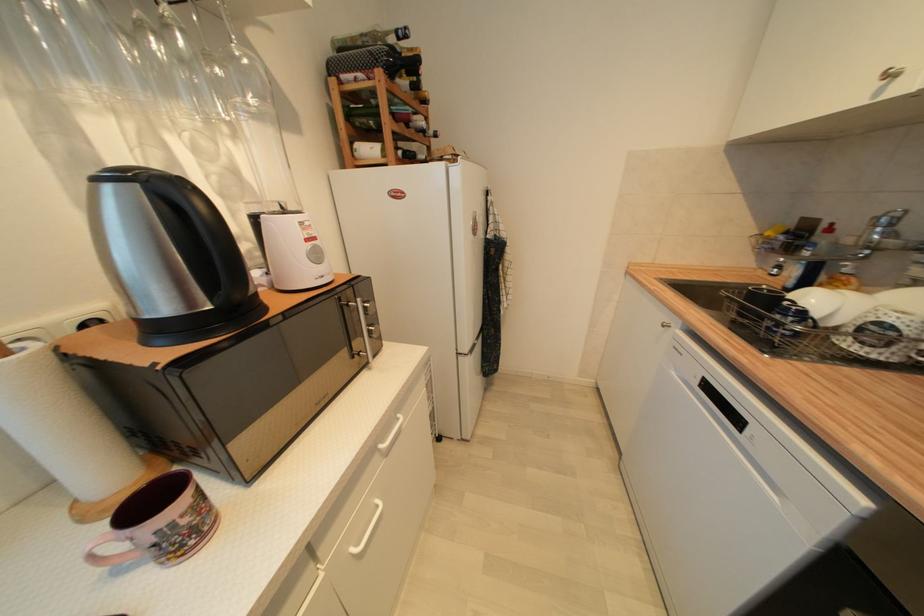
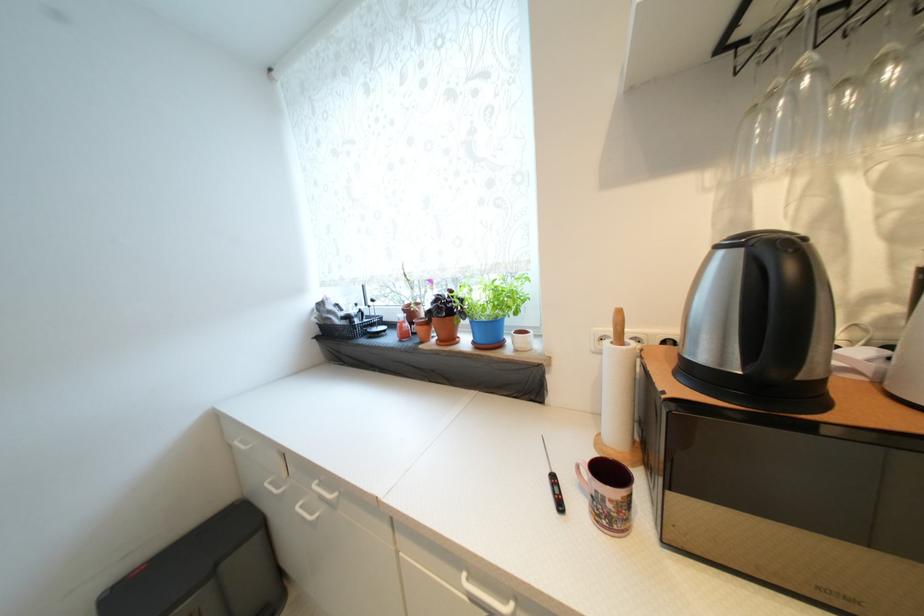
Find the pixel in the second image that matches the point at 102,182 in the first image.

(723, 249)